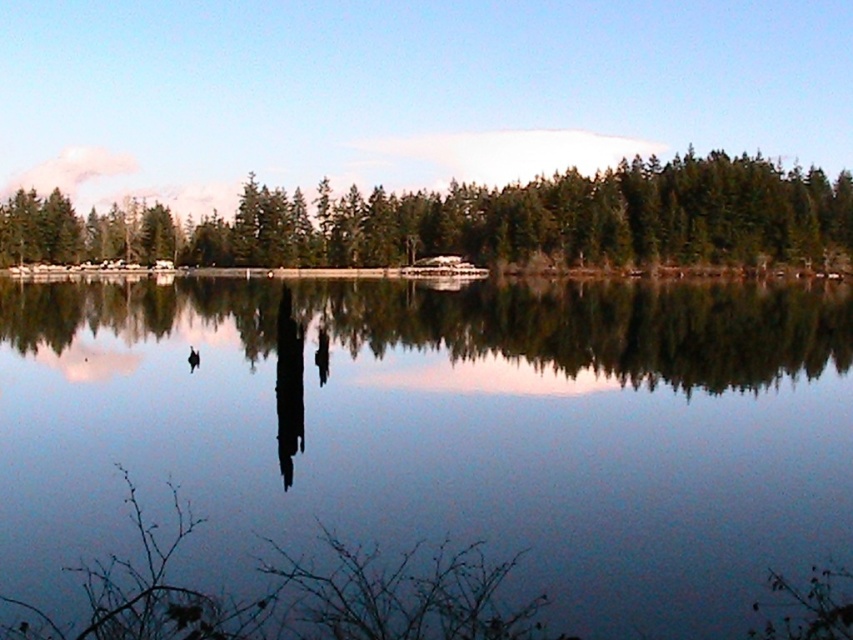
Question: Which object is positioned closest to the white plastic boat at center?

Choices:
 (A) transparent water at center
 (B) green matte trees at center

Answer: (B)

Question: In this image, where is green matte trees at center located relative to white plastic boat at center?

Choices:
 (A) left
 (B) right

Answer: (A)

Question: Among these objects, which one is nearest to the camera?

Choices:
 (A) green matte trees at center
 (B) white plastic boat at center
 (C) transparent water at center

Answer: (C)

Question: Can you confirm if transparent water at center is smaller than green matte trees at center?

Choices:
 (A) yes
 (B) no

Answer: (A)

Question: Which point appears closest to the camera in this image?

Choices:
 (A) (390, 236)
 (B) (820, 509)

Answer: (B)

Question: Is transparent water at center wider than white plastic boat at center?

Choices:
 (A) yes
 (B) no

Answer: (A)